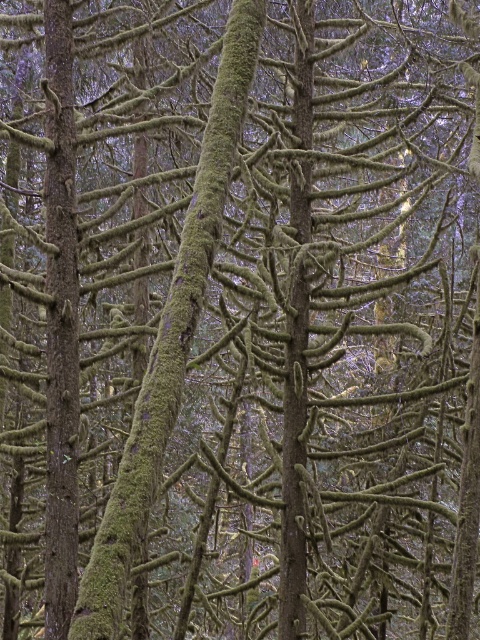
You are navigating through a dense forest and need to locate a specific point. The scene shows a dense forest with tall trees covered in moss. The trees are closely packed, creating a thick canopy. You see a point at coordinates (170, 333). What object is located at this point?

The point at coordinates (170, 333) corresponds to the green mossy tree trunk at center.

You are a hiker navigating through the dense forest and want to reach the green mossy tree trunk at left. Which direction should you move relative to the green mossy tree trunk at center to get there?

To reach the green mossy tree trunk at left, you should move towards the left side of the green mossy tree trunk at center since the green mossy tree trunk at left is positioned to the left of the trunk at center.

You are navigating through the dense forest and need to locate the green mossy tree trunk at center. According to the coordinates provided, where exactly is it positioned?

The green mossy tree trunk at center is located at point (170, 333), so it is positioned at that coordinate point.